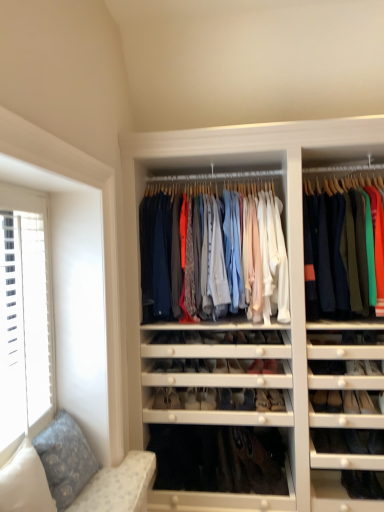
Question: Is the surface of matte black shoe at center, the 1th shoe when ordered from left to right, in direct contact with matte black shoe at center, the 1th shoe viewed from the right?

Choices:
 (A) no
 (B) yes

Answer: (A)

Question: From the image's perspective, does matte black shoe at center, which is counted as the 7th shoe, starting from the right, appear lower than matte black shoe at center, the 1th shoe viewed from the right?

Choices:
 (A) yes
 (B) no

Answer: (A)

Question: Could matte black shoe at center, arranged as the seventh shoe when viewed from the left, be considered to be inside matte black shoe at center, the 1th shoe when ordered from left to right?

Choices:
 (A) yes
 (B) no

Answer: (B)

Question: Can you confirm if matte black shoe at center, the 1th shoe when ordered from left to right, is taller than matte black shoe at center, arranged as the seventh shoe when viewed from the left?

Choices:
 (A) no
 (B) yes

Answer: (B)

Question: Is matte black shoe at center, the 1th shoe when ordered from left to right, looking in the opposite direction of matte black shoe at center, the 1th shoe viewed from the right?

Choices:
 (A) yes
 (B) no

Answer: (B)

Question: From the image's perspective, is matte black shoe at center, arranged as the 5th shoe when viewed from the left, above or below matte black shoe at center, the 6th shoe positioned from the right?

Choices:
 (A) above
 (B) below

Answer: (B)

Question: Is matte black shoe at center, arranged as the 3th shoe when viewed from the right, inside the boundaries of matte black shoe at center, the 6th shoe positioned from the right, or outside?

Choices:
 (A) inside
 (B) outside

Answer: (B)

Question: Is matte black shoe at center, arranged as the 3th shoe when viewed from the right, taller or shorter than matte black shoe at center, which is the second shoe in left-to-right order?

Choices:
 (A) short
 (B) tall

Answer: (B)

Question: From a real-world perspective, is matte black shoe at center, arranged as the 3th shoe when viewed from the right, positioned above or below matte black shoe at center, the 6th shoe positioned from the right?

Choices:
 (A) above
 (B) below

Answer: (B)

Question: Is point (182, 371) positioned closer to the camera than point (185, 400)?

Choices:
 (A) closer
 (B) farther

Answer: (A)

Question: In the image, is matte black shoe at center, which is the second shoe in left-to-right order, positioned in front of or behind matte white shoe at center, which is counted as the 3th shoe, starting from the left?

Choices:
 (A) front
 (B) behind

Answer: (A)

Question: From a real-world perspective, is matte black shoe at center, which is the second shoe in left-to-right order, physically located above or below matte white shoe at center, which is counted as the 3th shoe, starting from the left?

Choices:
 (A) below
 (B) above

Answer: (B)

Question: In the image, is matte black shoe at center, the 6th shoe positioned from the right, on the left side or the right side of matte white shoe at center, which is counted as the 3th shoe, starting from the left?

Choices:
 (A) right
 (B) left

Answer: (B)

Question: Considering the positions of white textured window at left and matte white shoe at center, arranged as the fourth shoe when viewed from the left, in the image, is white textured window at left wider or thinner than matte white shoe at center, arranged as the fourth shoe when viewed from the left,?

Choices:
 (A) thin
 (B) wide

Answer: (A)

Question: Considering the positions of white textured window at left and matte white shoe at center, which is the fourth shoe in right-to-left order, in the image, is white textured window at left bigger or smaller than matte white shoe at center, which is the fourth shoe in right-to-left order,?

Choices:
 (A) big
 (B) small

Answer: (A)